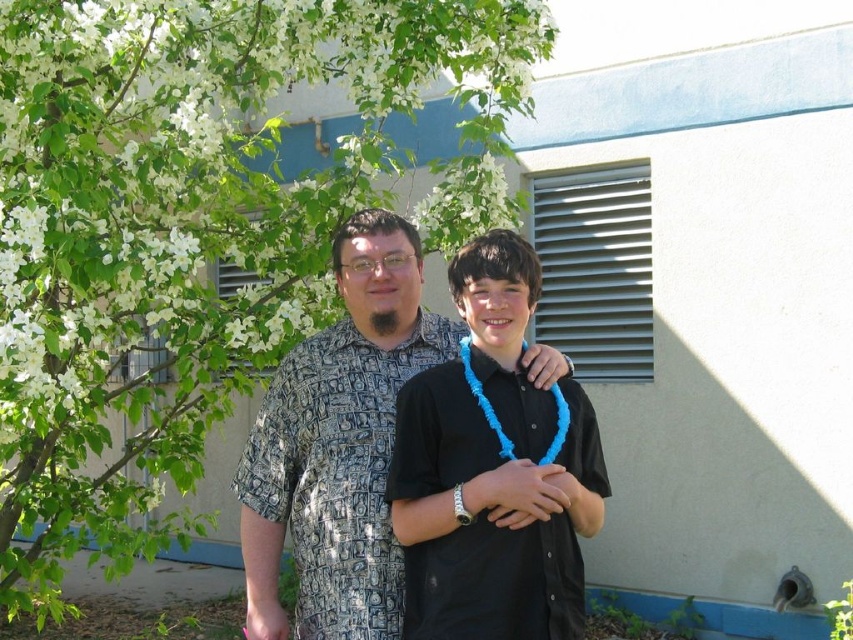
You are standing in front of the building with a light exterior and blue trim. You notice a point marked at coordinates (194,227). What object is located at this point?

The point at (194,227) is where the green leafy tree at upper left is located.

You are taking a photo of the scene and want to ensure the green leafy tree at upper left and the black matte shirt at center are both visible. Which object should you adjust your camera angle to focus on first to avoid blocking the other?

The green leafy tree at upper left is positioned on the left side of black matte shirt at center. To ensure both are visible, focus on the green leafy tree at upper left first before adjusting for the black matte shirt at center to avoid blocking it.

You are a photographer trying to capture a portrait of the two people in the scene. Since the green leafy tree at upper left and the black matte shirt at center are in the background, which one should you adjust your camera focus to ensure the subject is clear while blurring the background?

The green leafy tree at upper left is larger in size than the black matte shirt at center, so adjusting the camera focus on the subjects while blurring the larger background element would be more effective. Therefore, focus on the subjects and blur the green leafy tree at upper left.